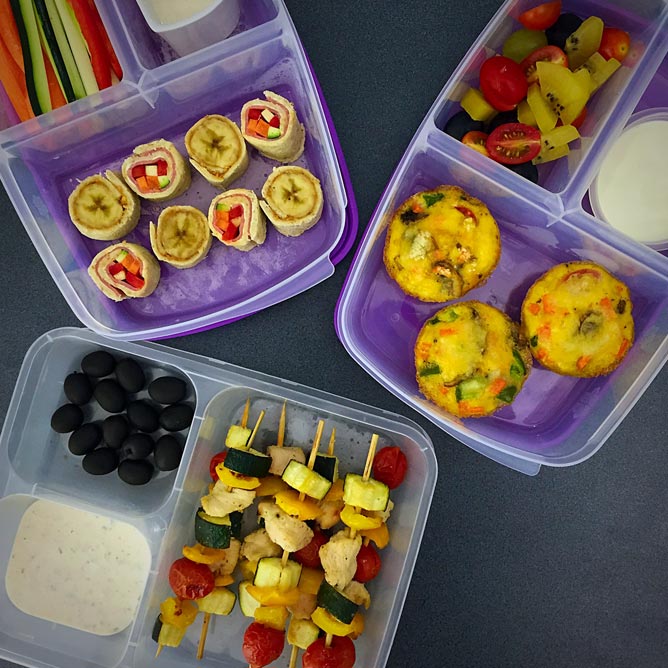
Where is `table`? table is located at coordinates (510, 534).